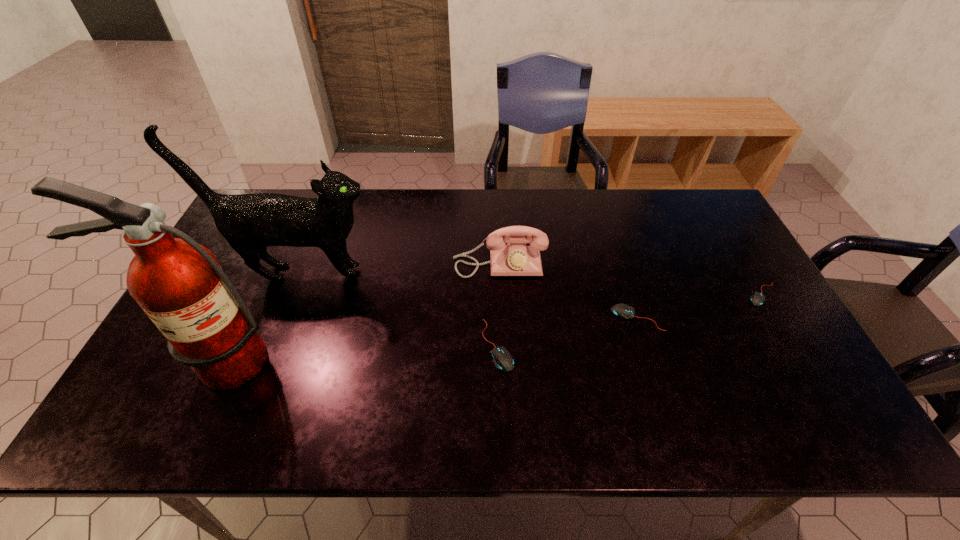
This screenshot has height=540, width=960. I want to click on vacant area that lies between the telephone and the rightmost object, so click(x=631, y=279).

The image size is (960, 540). I want to click on unoccupied position between the third tallest object and the cat, so click(x=400, y=268).

Locate an element on the screen. vacant space in between the cat and the second mouse from left to right is located at coordinates (469, 295).

Identify which object is the closest to the cat. Please provide its 2D coordinates. Your answer should be formatted as a tuple, i.e. [(x, y)], where the tuple contains the x and y coordinates of a point satisfying the conditions above.

[(179, 284)]

Identify which object is located as the third nearest to the telephone. Please provide its 2D coordinates. Your answer should be formatted as a tuple, i.e. [(x, y)], where the tuple contains the x and y coordinates of a point satisfying the conditions above.

[(249, 222)]

The image size is (960, 540). I want to click on mouse that stands as the second closest to the fourth shortest object, so click(624, 311).

Choose which mouse is the second nearest neighbor to the second object from right to left. Please provide its 2D coordinates. Your answer should be formatted as a tuple, i.e. [(x, y)], where the tuple contains the x and y coordinates of a point satisfying the conditions above.

[(503, 360)]

This screenshot has height=540, width=960. I want to click on free space that satisfies the following two spatial constraints: 1. on the face of the leftmost mouse; 2. on the left side of the cat, so click(x=273, y=345).

In order to click on vacant region that satisfies the following two spatial constraints: 1. on the face of the cat; 2. on the nozzle and handle of the fire extinguisher in this screenshot , I will do `click(266, 362)`.

Identify the location of free spot that satisfies the following two spatial constraints: 1. on the face of the cat; 2. on the nozzle and handle of the fire extinguisher. The image size is (960, 540). (266, 362).